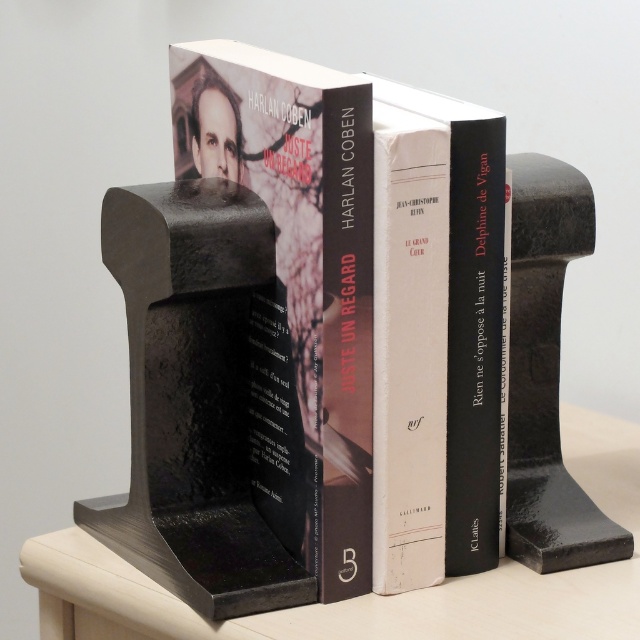
Looking at the scene with the three books and bookends, which object is taller between the matte black book at center and the smooth matte black bookends at center?

The matte black book at center is taller than the smooth matte black bookends at center.